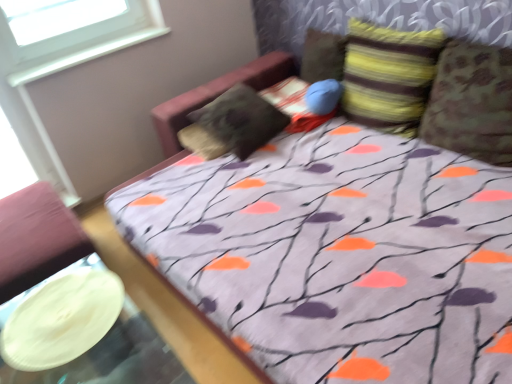
Question: Should I look upward or downward to see striped fabric pillow at upper center, which is the 3th pillow from right to left?

Choices:
 (A) down
 (B) up

Answer: (B)

Question: Is the position of white plastic window at upper left less distant than that of striped fabric pillow at upper right, which ranks as the second pillow in right-to-left order?

Choices:
 (A) no
 (B) yes

Answer: (A)

Question: From a real-world perspective, is white plastic window at upper left physically above striped fabric pillow at upper right, positioned as the 3th pillow in left-to-right order?

Choices:
 (A) yes
 (B) no

Answer: (A)

Question: From the image's perspective, is white plastic window at upper left located beneath striped fabric pillow at upper right, positioned as the 3th pillow in left-to-right order?

Choices:
 (A) no
 (B) yes

Answer: (A)

Question: Is white plastic window at upper left turned away from striped fabric pillow at upper right, which ranks as the second pillow in right-to-left order?

Choices:
 (A) no
 (B) yes

Answer: (A)

Question: Considering the relative sizes of white plastic window at upper left and striped fabric pillow at upper right, which ranks as the second pillow in right-to-left order, in the image provided, is white plastic window at upper left thinner than striped fabric pillow at upper right, which ranks as the second pillow in right-to-left order,?

Choices:
 (A) yes
 (B) no

Answer: (A)

Question: Is white plastic window at upper left completely or partially outside of striped fabric pillow at upper right, which ranks as the second pillow in right-to-left order?

Choices:
 (A) yes
 (B) no

Answer: (A)

Question: Is striped fabric pillow at upper center, which is the 3th pillow from right to left, further to camera compared to camouflage fabric pillow at right, which ranks as the 1th pillow in right-to-left order?

Choices:
 (A) yes
 (B) no

Answer: (A)

Question: From the image's perspective, does striped fabric pillow at upper center, the second pillow from the left, appear higher than camouflage fabric pillow at right, which ranks as the 1th pillow in right-to-left order?

Choices:
 (A) yes
 (B) no

Answer: (A)

Question: Is striped fabric pillow at upper center, the second pillow from the left, aimed at camouflage fabric pillow at right, the 4th pillow positioned from the left?

Choices:
 (A) no
 (B) yes

Answer: (A)

Question: From a real-world perspective, is striped fabric pillow at upper center, the second pillow from the left, under camouflage fabric pillow at right, the 4th pillow positioned from the left?

Choices:
 (A) yes
 (B) no

Answer: (B)

Question: Is camouflage fabric pillow at right, which ranks as the 1th pillow in right-to-left order, at the back of striped fabric pillow at upper center, the second pillow from the left?

Choices:
 (A) no
 (B) yes

Answer: (A)

Question: Does striped fabric pillow at upper center, the second pillow from the left, have a greater height compared to camouflage fabric pillow at right, the 4th pillow positioned from the left?

Choices:
 (A) no
 (B) yes

Answer: (A)

Question: Is white plastic window at upper left wider than camouflage fabric pillow at right, the 4th pillow positioned from the left?

Choices:
 (A) no
 (B) yes

Answer: (A)